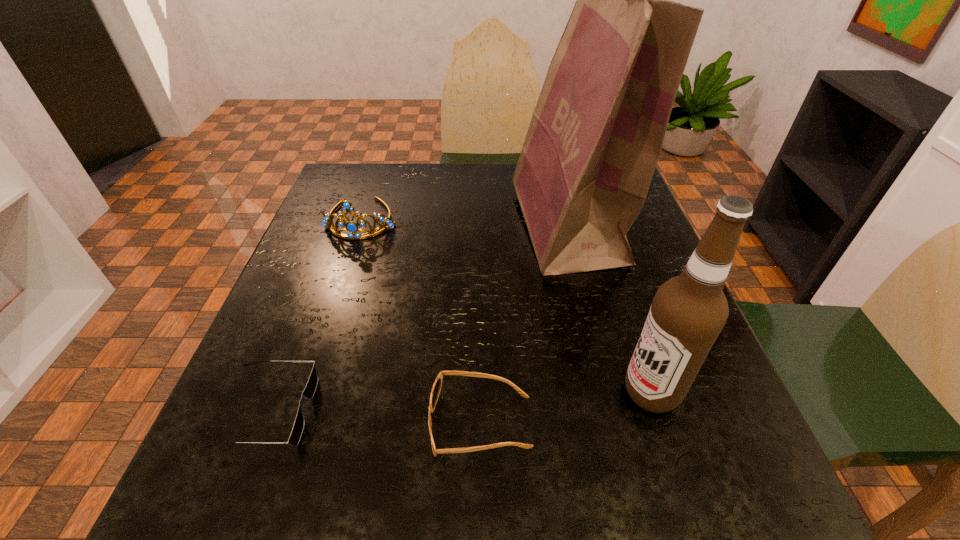
The image size is (960, 540). Find the location of `object that is at the near edge`. object that is at the near edge is located at coordinates (437, 385).

This screenshot has width=960, height=540. What are the coordinates of `tiara that is at the left edge` in the screenshot? It's located at (351, 227).

Image resolution: width=960 pixels, height=540 pixels. Find the location of `sunglasses present at the left edge`. sunglasses present at the left edge is located at coordinates (310, 389).

This screenshot has height=540, width=960. I want to click on grocery bag present at the right edge, so click(x=593, y=143).

The height and width of the screenshot is (540, 960). I want to click on alcohol that is at the right edge, so click(688, 312).

You are a GUI agent. You are given a task and a screenshot of the screen. Output one action in this format:
    pyautogui.click(x=<x>, y=<y>)
    Task: Click on the object that is positioned at the far left corner
    
    Given the screenshot: What is the action you would take?
    (x=351, y=227)

Where is `object located at the far right corner`? The image size is (960, 540). object located at the far right corner is located at coordinates (593, 143).

The width and height of the screenshot is (960, 540). Find the location of `free region at the far edge`. free region at the far edge is located at coordinates (508, 198).

I want to click on vacant region at the near edge of the desktop, so click(565, 465).

The image size is (960, 540). I want to click on free spot at the left edge of the desktop, so click(x=332, y=306).